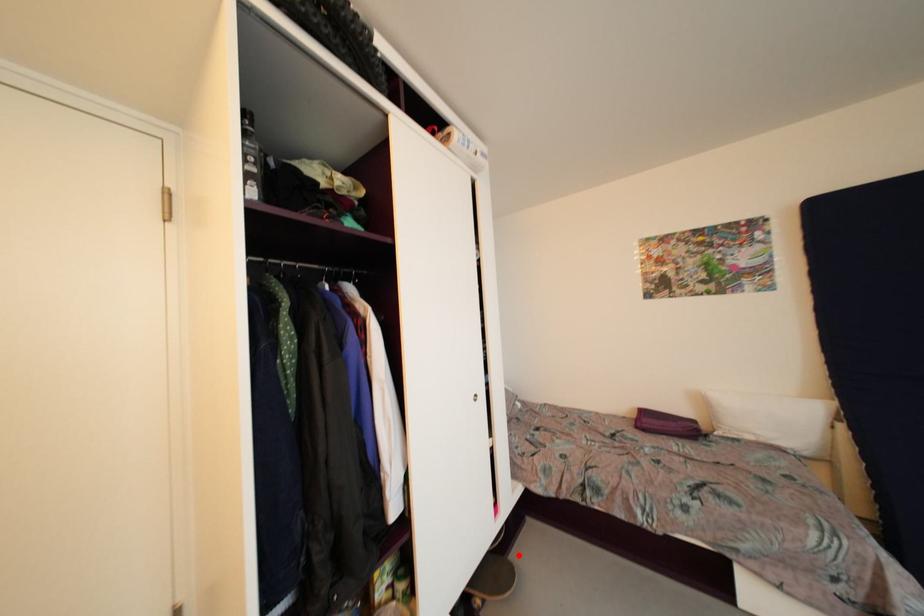
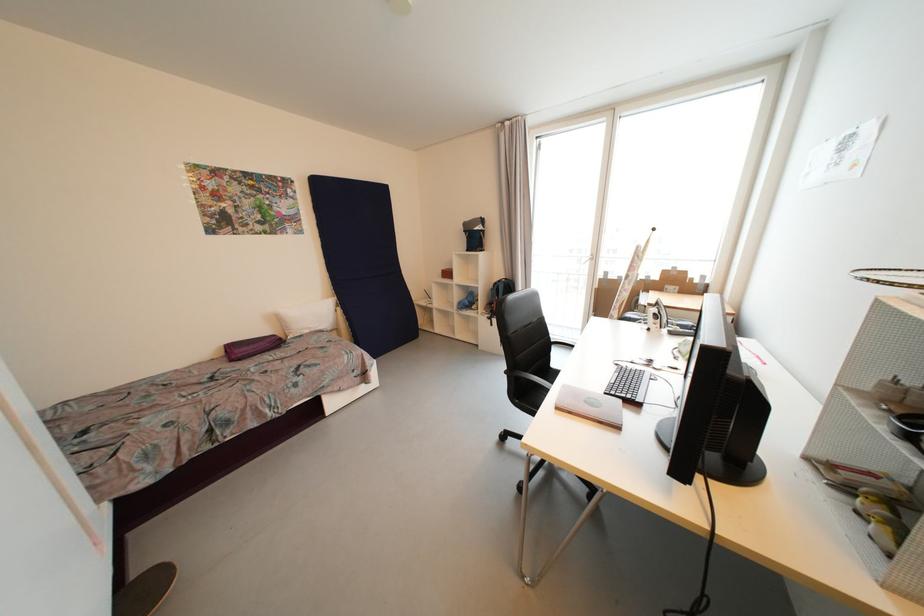
Locate, in the second image, the point that corresponds to the highlighted location in the first image.

(140, 578)